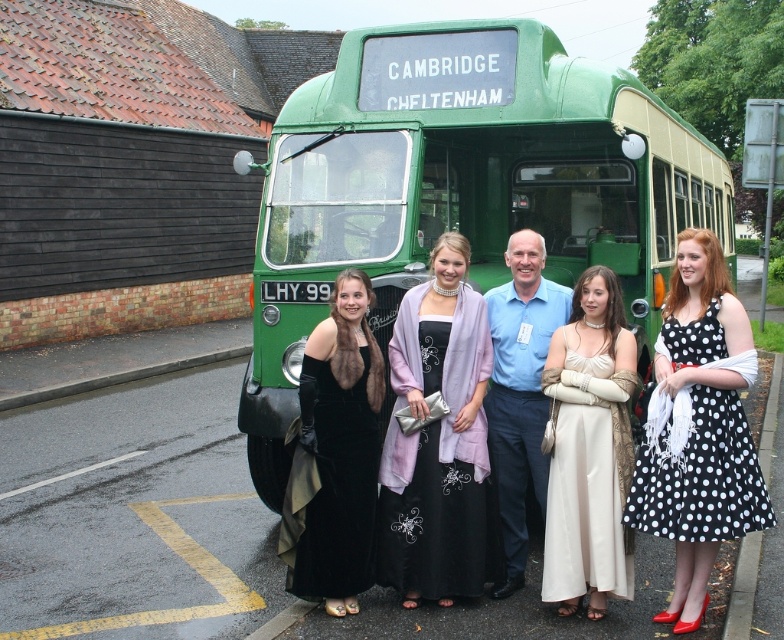
Can you confirm if blue cotton shirt at center is positioned above green metal pole at upper right?

Actually, blue cotton shirt at center is below green metal pole at upper right.

Identify the location of blue cotton shirt at center. (521, 392).

Is velvet black dress at center bigger than green metal pole at upper right?

No, velvet black dress at center is not bigger than green metal pole at upper right.

Is velvet black dress at center positioned before green metal pole at upper right?

Yes.

Is point (350, 612) more distant than point (766, 100)?

No, it is not.

The height and width of the screenshot is (640, 784). In order to click on velvet black dress at center in this screenshot , I will do `click(339, 449)`.

Is black polka dot dress at center smaller than blue cotton shirt at center?

Incorrect, black polka dot dress at center is not smaller in size than blue cotton shirt at center.

Is point (662, 403) closer to camera compared to point (494, 294)?

Yes, it is in front of point (494, 294).

The image size is (784, 640). Find the location of `black polka dot dress at center`. black polka dot dress at center is located at coordinates (699, 428).

At what (x,y) coordinates should I click in order to perform the action: click on black polka dot dress at center. Please return your answer as a coordinate pair (x, y). Image resolution: width=784 pixels, height=640 pixels. Looking at the image, I should click on (699, 428).